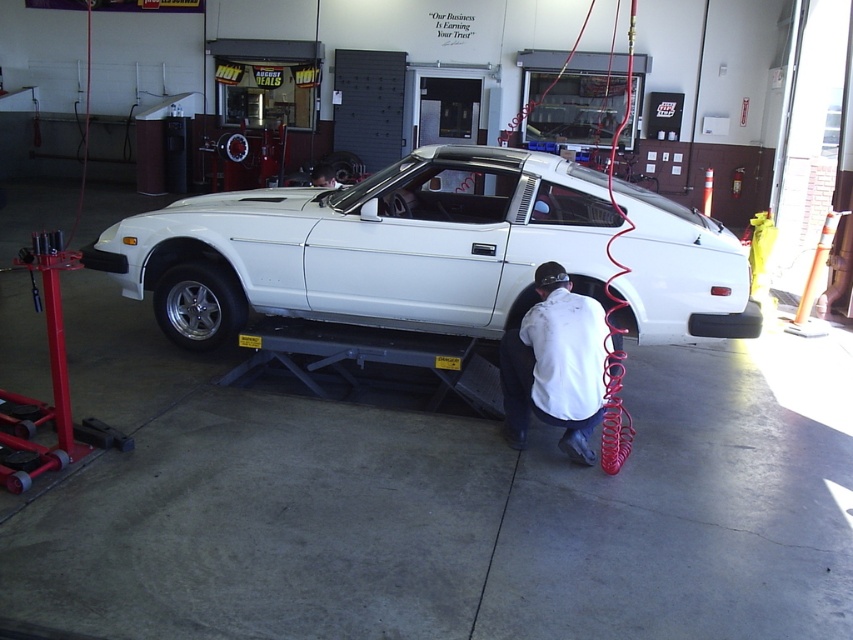
You are a mechanic in the garage. You need to access the engine compartment of the white matte car at center. The white matte shirt at lower center is blocking your path. Can you move around the car to reach the engine without disturbing the person?

The white matte car at center is located above the white matte shirt at lower center, meaning the shirt is closer to you. You can move around the sides of the car to reach the engine compartment without disturbing the person in the white matte shirt at lower center.

Where is the white matte car at center located in the image?

The white matte car at center is located at point coordinates of (370,246).